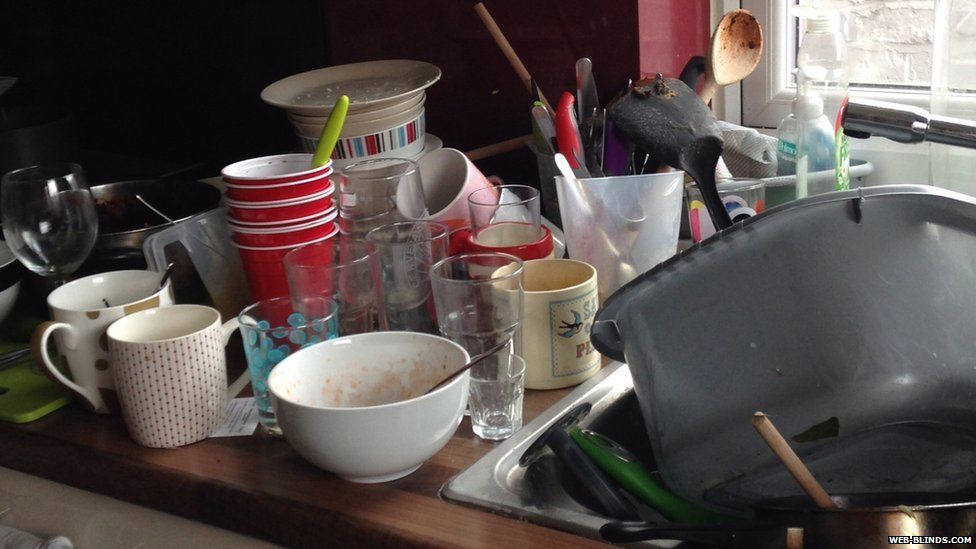
Find the location of `glassware`. glassware is located at coordinates (395, 188), (362, 278), (415, 251), (506, 212), (477, 306), (512, 389), (296, 327), (66, 217).